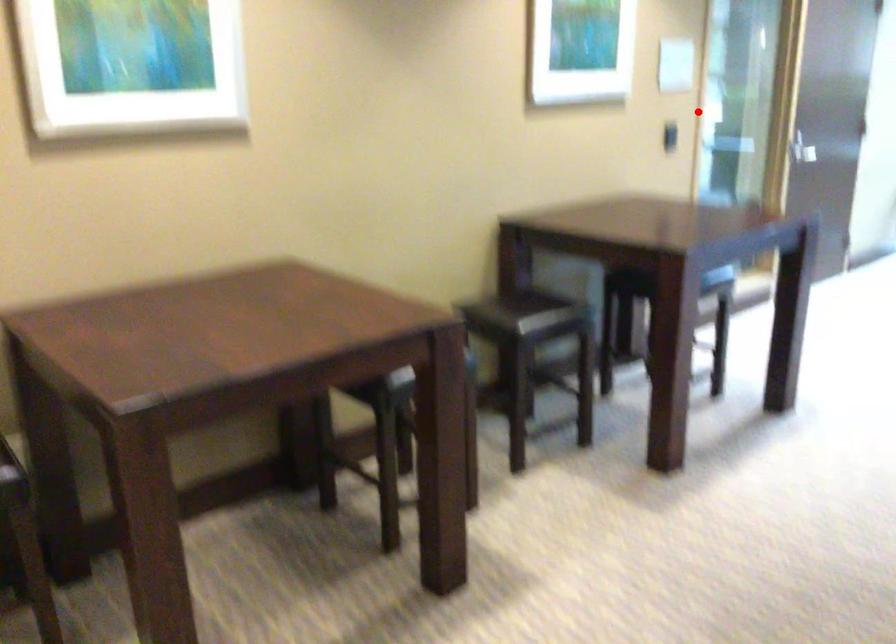
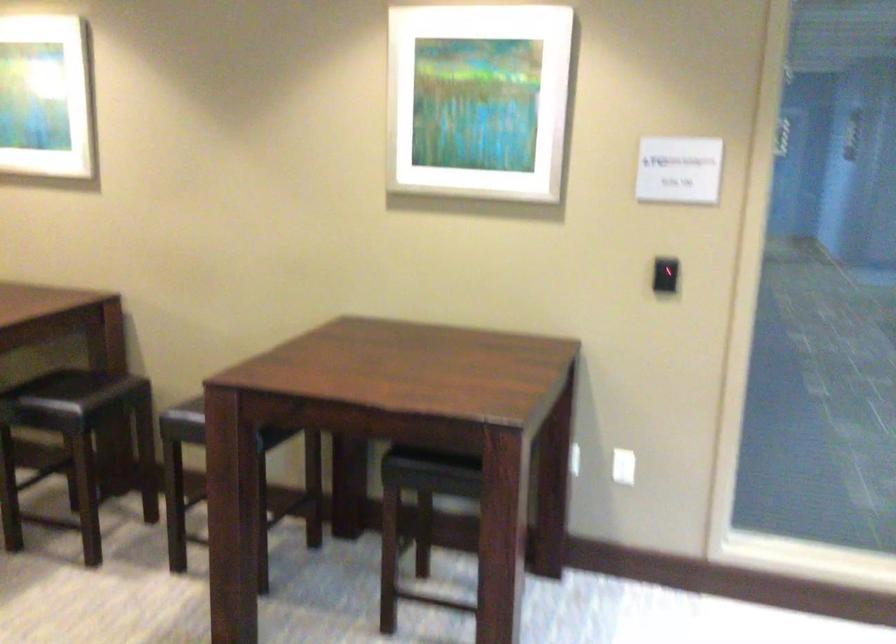
Question: I am providing you with two images of the same scene from different viewpoints. In image1, a red point is highlighted. Considering the same 3D point in image2, which of the following is correct?

Choices:
 (A) It is closer
 (B) It is farther

Answer: (A)